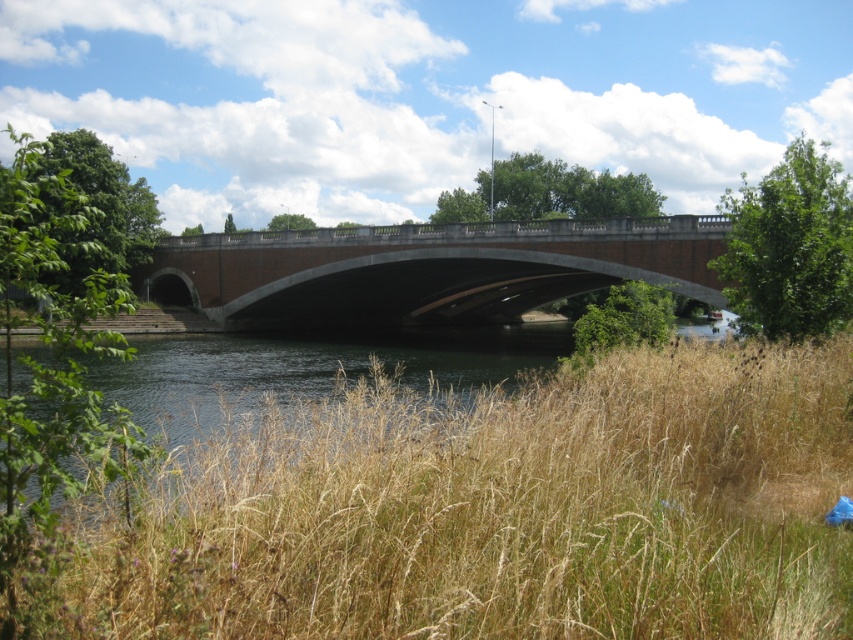
Question: Which point is farther from the camera taking this photo?

Choices:
 (A) (326, 289)
 (B) (456, 444)

Answer: (A)

Question: Which point is closer to the camera?

Choices:
 (A) (285, 513)
 (B) (347, 244)

Answer: (A)

Question: Is dry grass at lower center thinner than brick stone bridge at center?

Choices:
 (A) yes
 (B) no

Answer: (A)

Question: Does dry grass at lower center have a lesser width compared to brick stone bridge at center?

Choices:
 (A) yes
 (B) no

Answer: (A)

Question: Does dry grass at lower center have a larger size compared to brick stone bridge at center?

Choices:
 (A) no
 (B) yes

Answer: (A)